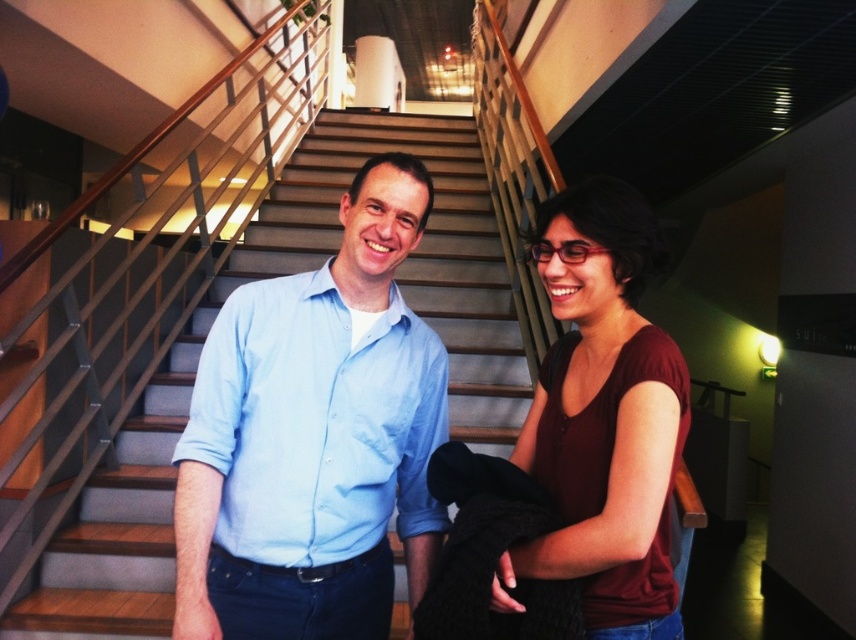
Question: Is wooden stairs at center further to camera compared to matte burgundy shirt at center?

Choices:
 (A) no
 (B) yes

Answer: (B)

Question: Does light blue shirt at center have a lesser width compared to wooden stairs at center?

Choices:
 (A) yes
 (B) no

Answer: (A)

Question: Estimate the real-world distances between objects in this image. Which object is closer to the matte burgundy shirt at center?

Choices:
 (A) wooden stairs at center
 (B) light blue shirt at center

Answer: (B)

Question: Which point is closer to the camera taking this photo?

Choices:
 (A) (220, 272)
 (B) (339, 504)
 (C) (622, 348)

Answer: (C)

Question: Which point appears farthest from the camera in this image?

Choices:
 (A) (153, 465)
 (B) (224, 442)
 (C) (599, 566)

Answer: (A)

Question: Is wooden stairs at center smaller than matte burgundy shirt at center?

Choices:
 (A) no
 (B) yes

Answer: (A)